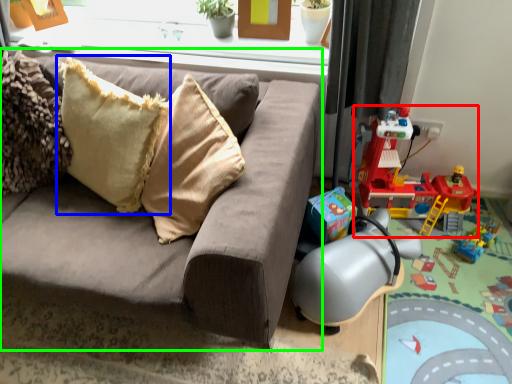
Question: Estimate the real-world distances between objects in this image. Which object is closer to toy (highlighted by a red box), pillow (highlighted by a blue box) or studio couch (highlighted by a green box)?

Choices:
 (A) pillow
 (B) studio couch

Answer: (B)